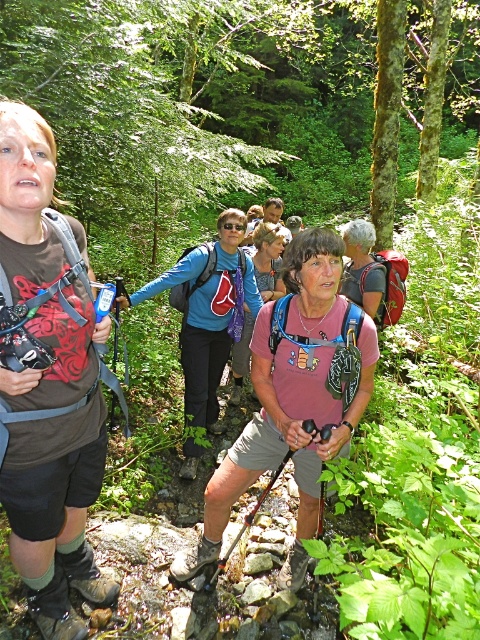
Can you confirm if brown fabric shirt at left is taller than pink fabric shirt at center?

Indeed, brown fabric shirt at left has a greater height compared to pink fabric shirt at center.

Between brown fabric shirt at left and pink fabric shirt at center, which one appears on the left side from the viewer's perspective?

brown fabric shirt at left is more to the left.

You are a GUI agent. You are given a task and a screenshot of the screen. Output one action in this format:
    pyautogui.click(x=<x>, y=<y>)
    Task: Click on the brown fabric shirt at left
    Image resolution: width=480 pixels, height=640 pixels.
    Given the screenshot: What is the action you would take?
    pyautogui.click(x=48, y=381)

Between brown fabric shirt at left and pink fabric backpack at center, which one has more height?

brown fabric shirt at left is taller.

Is brown fabric shirt at left shorter than pink fabric backpack at center?

Incorrect, brown fabric shirt at left's height does not fall short of pink fabric backpack at center's.

Which is behind, point (44, 616) or point (235, 394)?

The point (235, 394) is more distant.

You are a GUI agent. You are given a task and a screenshot of the screen. Output one action in this format:
    pyautogui.click(x=<x>, y=<y>)
    Task: Click on the brown fabric shirt at left
    The width and height of the screenshot is (480, 640).
    Given the screenshot: What is the action you would take?
    pyautogui.click(x=48, y=381)

Does point (309, 403) come closer to viewer compared to point (280, 243)?

Yes.

Between pink fabric shirt at center and pink fabric backpack at center, which one appears on the right side from the viewer's perspective?

pink fabric shirt at center is more to the right.

What do you see at coordinates (290, 400) in the screenshot? The width and height of the screenshot is (480, 640). I see `pink fabric shirt at center` at bounding box center [290, 400].

I want to click on pink fabric shirt at center, so click(290, 400).